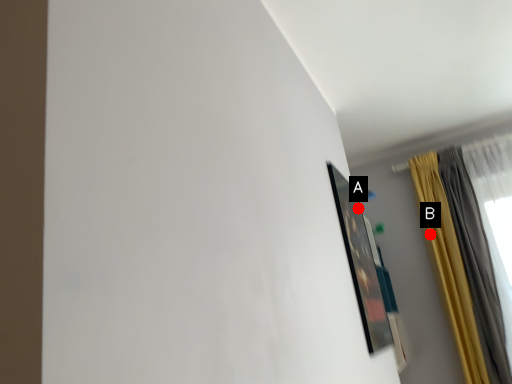
Question: Two points are circled on the image, labeled by A and B beside each circle. Which point is farther to the camera?

Choices:
 (A) A is further
 (B) B is further

Answer: (B)